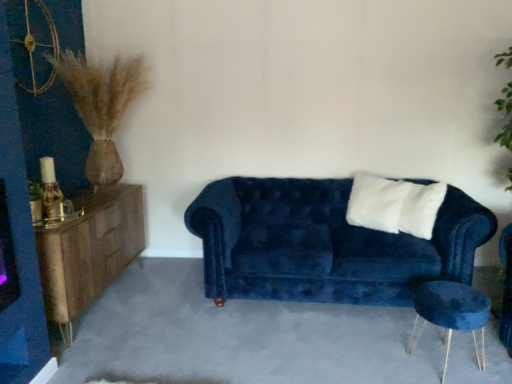
In order to click on free space below velvet blue side table at lower right (from a real-world perspective) in this screenshot , I will do `click(441, 357)`.